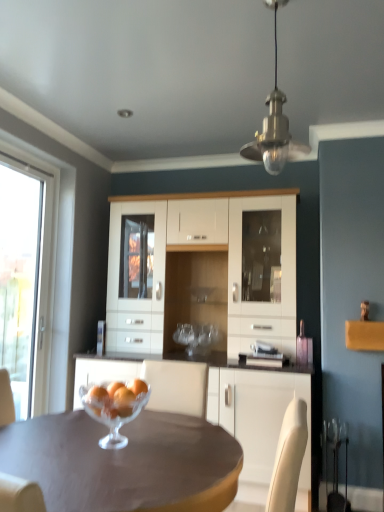
At what (x,y) coordinates should I click in order to perform the action: click on free space to the left of clear glass bowl at center. Please return your answer as a coordinate pair (x, y). Looking at the image, I should click on (52, 445).